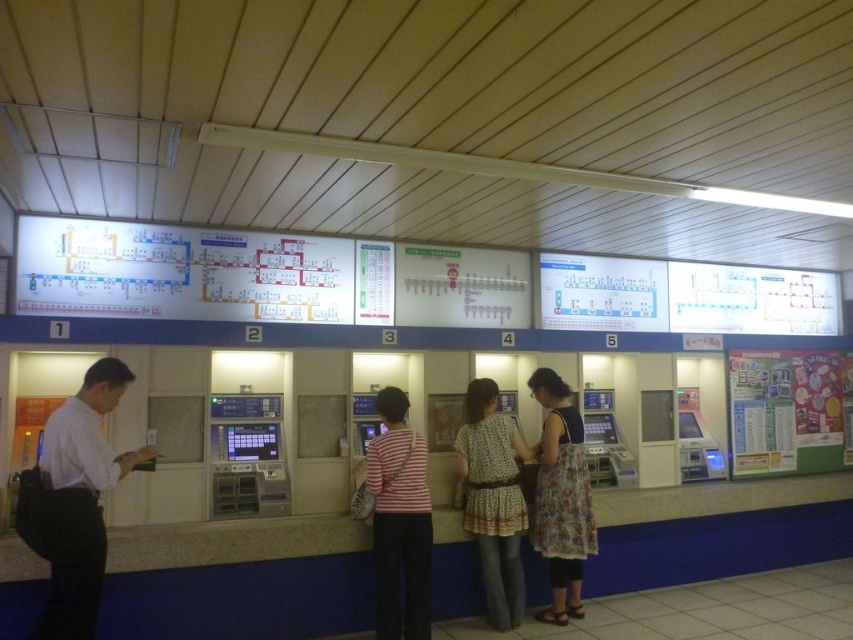
Question: Is white shirt at left to the right of striped cotton shirt at center from the viewer's perspective?

Choices:
 (A) yes
 (B) no

Answer: (B)

Question: Can you confirm if dotted fabric blouse at center is positioned to the right of floral dress at center?

Choices:
 (A) no
 (B) yes

Answer: (A)

Question: Can you confirm if white shirt at left is positioned to the left of striped cotton shirt at center?

Choices:
 (A) no
 (B) yes

Answer: (B)

Question: Which object is the farthest from the striped cotton shirt at center?

Choices:
 (A) white shirt at left
 (B) floral dress at center

Answer: (A)

Question: Which object is positioned closest to the dotted fabric blouse at center?

Choices:
 (A) white shirt at left
 (B) floral dress at center

Answer: (B)

Question: Estimate the real-world distances between objects in this image. Which object is closer to the white shirt at left?

Choices:
 (A) dotted fabric blouse at center
 (B) floral dress at center

Answer: (A)